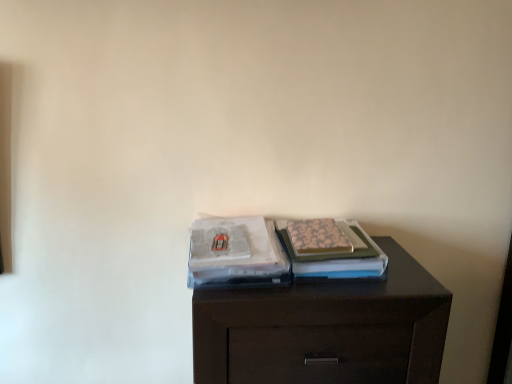
Locate an element on the screen. This screenshot has height=384, width=512. patterned paper magazine at center, which ranks as the 2th magazine in left-to-right order is located at coordinates (338, 256).

Where is `matte plastic magazine at center, which is the first magazine from left to right`? The width and height of the screenshot is (512, 384). matte plastic magazine at center, which is the first magazine from left to right is located at coordinates (236, 254).

Considering the sizes of objects dark wood chest of drawers at center and matte plastic magazine at center, which is the first magazine from left to right, in the image provided, who is taller, dark wood chest of drawers at center or matte plastic magazine at center, which is the first magazine from left to right,?

With more height is dark wood chest of drawers at center.

Is dark wood chest of drawers at center oriented towards matte plastic magazine at center, the 2th magazine from the right?

No, dark wood chest of drawers at center is not aimed at matte plastic magazine at center, the 2th magazine from the right.

Is dark wood chest of drawers at center closer to the viewer compared to matte plastic magazine at center, the 2th magazine from the right?

Yes, dark wood chest of drawers at center is in front of matte plastic magazine at center, the 2th magazine from the right.

Is patterned paper magazine at center, which ranks as the first magazine in right-to-left order, positioned behind matte plastic magazine at center, the 2th magazine from the right?

That is True.

Could you tell me if patterned paper magazine at center, which ranks as the first magazine in right-to-left order, is turned towards matte plastic magazine at center, the 2th magazine from the right?

No, patterned paper magazine at center, which ranks as the first magazine in right-to-left order, is not turned towards matte plastic magazine at center, the 2th magazine from the right.

From a real-world perspective, which is physically below, patterned paper magazine at center, which ranks as the first magazine in right-to-left order, or matte plastic magazine at center, which is the first magazine from left to right?

matte plastic magazine at center, which is the first magazine from left to right, is physically lower.

Considering the sizes of objects patterned paper magazine at center, which ranks as the 2th magazine in left-to-right order, and matte plastic magazine at center, which is the first magazine from left to right, in the image provided, who is thinner, patterned paper magazine at center, which ranks as the 2th magazine in left-to-right order, or matte plastic magazine at center, which is the first magazine from left to right,?

patterned paper magazine at center, which ranks as the 2th magazine in left-to-right order, is thinner.

Can you confirm if matte plastic magazine at center, the 2th magazine from the right, is positioned to the right of patterned paper magazine at center, which ranks as the 2th magazine in left-to-right order?

No.

I want to click on magazine above the matte plastic magazine at center, the 2th magazine from the right (from a real-world perspective), so click(x=338, y=256).

From a real-world perspective, who is located lower, matte plastic magazine at center, the 2th magazine from the right, or patterned paper magazine at center, which ranks as the 2th magazine in left-to-right order?

From a 3D spatial view, matte plastic magazine at center, the 2th magazine from the right, is below.

Is matte plastic magazine at center, the 2th magazine from the right, in front of or behind patterned paper magazine at center, which ranks as the 2th magazine in left-to-right order, in the image?

Clearly, matte plastic magazine at center, the 2th magazine from the right, is in front of patterned paper magazine at center, which ranks as the 2th magazine in left-to-right order.

Which is less distant, (324, 315) or (308, 255)?

Point (324, 315)

Considering the positions of objects dark wood chest of drawers at center and patterned paper magazine at center, which ranks as the first magazine in right-to-left order, in the image provided, who is more to the right, dark wood chest of drawers at center or patterned paper magazine at center, which ranks as the first magazine in right-to-left order,?

Positioned to the right is patterned paper magazine at center, which ranks as the first magazine in right-to-left order.

Measure the distance between dark wood chest of drawers at center and patterned paper magazine at center, which ranks as the first magazine in right-to-left order.

→ 5.50 inches.

Does dark wood chest of drawers at center have a greater width compared to patterned paper magazine at center, which ranks as the first magazine in right-to-left order?

Yes.

Looking at this image, can you confirm if patterned paper magazine at center, which ranks as the 2th magazine in left-to-right order, is smaller than dark wood chest of drawers at center?

Yes.

What's the angular difference between patterned paper magazine at center, which ranks as the first magazine in right-to-left order, and dark wood chest of drawers at center's facing directions?

The angular difference between patterned paper magazine at center, which ranks as the first magazine in right-to-left order, and dark wood chest of drawers at center is 2.07e-05 degrees.

Who is more distant, patterned paper magazine at center, which ranks as the 2th magazine in left-to-right order, or dark wood chest of drawers at center?

patterned paper magazine at center, which ranks as the 2th magazine in left-to-right order, is behind.

Find the location of a particular element. Image resolution: width=512 pixels, height=384 pixels. chest of drawers on the left of patterned paper magazine at center, which ranks as the first magazine in right-to-left order is located at coordinates (325, 329).

Between matte plastic magazine at center, the 2th magazine from the right, and dark wood chest of drawers at center, which one appears on the right side from the viewer's perspective?

dark wood chest of drawers at center is more to the right.

Is matte plastic magazine at center, the 2th magazine from the right, taller or shorter than dark wood chest of drawers at center?

Considering their sizes, matte plastic magazine at center, the 2th magazine from the right, has less height than dark wood chest of drawers at center.

Based on the photo, in terms of width, does matte plastic magazine at center, which is the first magazine from left to right, look wider or thinner when compared to dark wood chest of drawers at center?

Clearly, matte plastic magazine at center, which is the first magazine from left to right, has less width compared to dark wood chest of drawers at center.

Does point (211, 249) come closer to viewer compared to point (352, 306)?

No, (211, 249) is behind (352, 306).

Image resolution: width=512 pixels, height=384 pixels. There is a dark wood chest of drawers at center. In order to click on the 1st magazine above it (from the image's perspective) in this screenshot , I will do `click(236, 254)`.

This screenshot has height=384, width=512. Identify the location of magazine on the right side of matte plastic magazine at center, which is the first magazine from left to right. (338, 256).

Estimate the real-world distances between objects in this image. Which object is closer to dark wood chest of drawers at center, matte plastic magazine at center, which is the first magazine from left to right, or patterned paper magazine at center, which ranks as the 2th magazine in left-to-right order?

patterned paper magazine at center, which ranks as the 2th magazine in left-to-right order, is closer to dark wood chest of drawers at center.

Based on their spatial positions, is patterned paper magazine at center, which ranks as the 2th magazine in left-to-right order, or dark wood chest of drawers at center closer to matte plastic magazine at center, the 2th magazine from the right?

patterned paper magazine at center, which ranks as the 2th magazine in left-to-right order, lies closer to matte plastic magazine at center, the 2th magazine from the right, than the other object.

Based on their spatial positions, is patterned paper magazine at center, which ranks as the 2th magazine in left-to-right order, or matte plastic magazine at center, which is the first magazine from left to right, further from dark wood chest of drawers at center?

Among the two, matte plastic magazine at center, which is the first magazine from left to right, is located further to dark wood chest of drawers at center.

When comparing their distances from matte plastic magazine at center, the 2th magazine from the right, does dark wood chest of drawers at center or patterned paper magazine at center, which ranks as the 2th magazine in left-to-right order, seem further?

dark wood chest of drawers at center is positioned further to the anchor matte plastic magazine at center, the 2th magazine from the right.

From the image, which object appears to be nearer to patterned paper magazine at center, which ranks as the first magazine in right-to-left order, dark wood chest of drawers at center or matte plastic magazine at center, the 2th magazine from the right?

matte plastic magazine at center, the 2th magazine from the right.

When comparing their distances from patterned paper magazine at center, which ranks as the 2th magazine in left-to-right order, does matte plastic magazine at center, the 2th magazine from the right, or dark wood chest of drawers at center seem closer?

matte plastic magazine at center, the 2th magazine from the right.

This screenshot has width=512, height=384. I want to click on magazine between patterned paper magazine at center, which ranks as the 2th magazine in left-to-right order, and dark wood chest of drawers at center, in the vertical direction, so click(x=236, y=254).